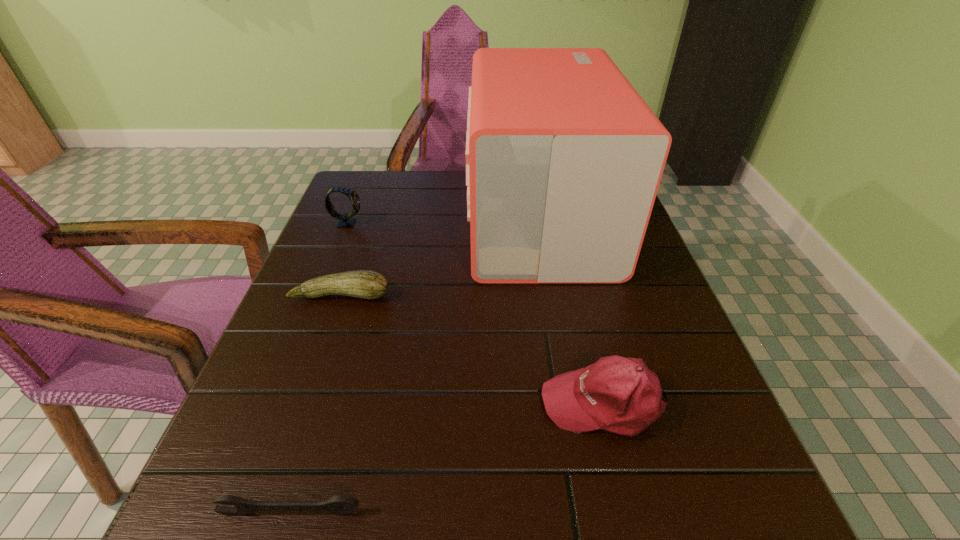
The width and height of the screenshot is (960, 540). What are the coordinates of `object that is the closest to the second nearest object` in the screenshot? It's located at (564, 158).

Locate an element on the screen. free space that satisfies the following two spatial constraints: 1. on the surface of the box where the text is embossed; 2. at the stem end of the third nearest object is located at coordinates [553, 295].

Identify the location of free location that satisfies the following two spatial constraints: 1. at the front of the baseball cap with the brim; 2. on the open ends of the wrench. (630, 514).